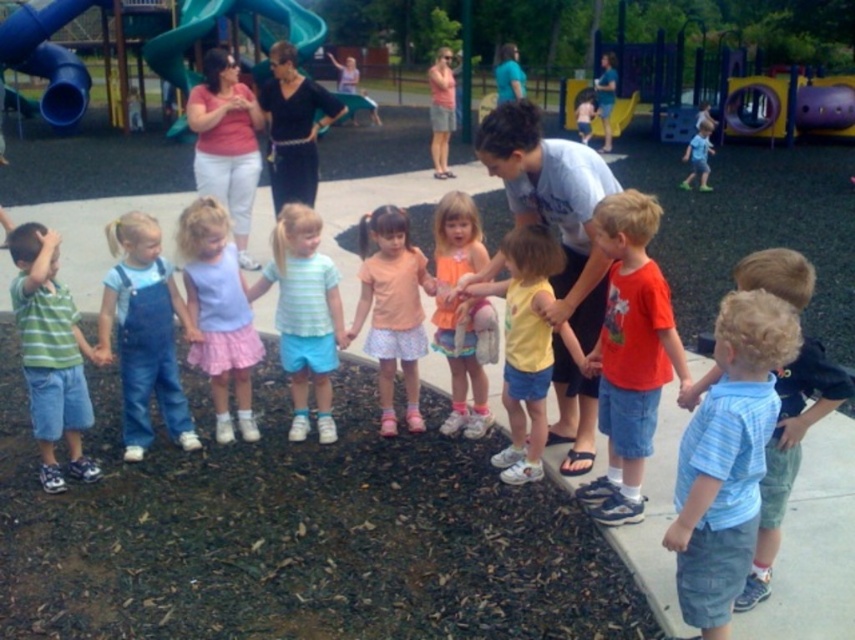
Question: Can you confirm if striped cotton shirt at center is smaller than blue plastic slide at upper left?

Choices:
 (A) yes
 (B) no

Answer: (B)

Question: Is blue striped shirt at center wider than blue denim shorts at center?

Choices:
 (A) yes
 (B) no

Answer: (B)

Question: Based on their relative distances, which object is farther from the yellow matte shirt at center?

Choices:
 (A) striped cotton shirt at center
 (B) light blue denim shorts at center
 (C) blue plastic slide at upper left

Answer: (C)

Question: Which object is the farthest from the pink floral skirt at center?

Choices:
 (A) light blue denim shorts at center
 (B) pastel blue fabric dress at center

Answer: (A)

Question: Does denim overalls at left appear under striped cotton shirt at left?

Choices:
 (A) yes
 (B) no

Answer: (B)

Question: Estimate the real-world distances between objects in this image. Which object is closer to the striped cotton shirt at left?

Choices:
 (A) striped cotton shirt at center
 (B) blue denim shorts at center
 (C) denim overalls at left

Answer: (C)